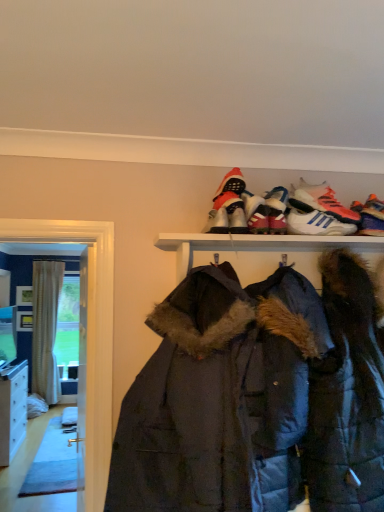
Question: Is dark blue quilted jacket at center to the right of white leather sneakers at upper center, which is the second footwear in right-to-left order, from the viewer's perspective?

Choices:
 (A) yes
 (B) no

Answer: (B)

Question: Considering the relative sizes of dark blue quilted jacket at center and white leather sneakers at upper center, which is the second footwear in right-to-left order, in the image provided, is dark blue quilted jacket at center taller than white leather sneakers at upper center, which is the second footwear in right-to-left order,?

Choices:
 (A) no
 (B) yes

Answer: (B)

Question: Is dark blue quilted jacket at center smaller than white leather sneakers at upper center, which is the 5th footwear in left-to-right order?

Choices:
 (A) no
 (B) yes

Answer: (A)

Question: Is dark blue quilted jacket at center oriented away from white leather sneakers at upper center, which is the second footwear in right-to-left order?

Choices:
 (A) yes
 (B) no

Answer: (B)

Question: Is dark blue quilted jacket at center not within white leather sneakers at upper center, which is the second footwear in right-to-left order?

Choices:
 (A) yes
 (B) no

Answer: (A)

Question: Does dark blue quilted jacket at center have a lesser height compared to white leather sneakers at upper center, which is the 5th footwear in left-to-right order?

Choices:
 (A) yes
 (B) no

Answer: (B)

Question: Can beige striped curtain at left be found inside red suede boot at upper center, the second footwear in the left-to-right sequence?

Choices:
 (A) no
 (B) yes

Answer: (A)

Question: Considering the relative positions of red suede boot at upper center, arranged as the fifth footwear when viewed from the right, and beige striped curtain at left in the image provided, is red suede boot at upper center, arranged as the fifth footwear when viewed from the right, in front of beige striped curtain at left?

Choices:
 (A) yes
 (B) no

Answer: (A)

Question: From a real-world perspective, is red suede boot at upper center, arranged as the fifth footwear when viewed from the right, physically above beige striped curtain at left?

Choices:
 (A) yes
 (B) no

Answer: (A)

Question: Considering the relative sizes of red suede boot at upper center, the second footwear in the left-to-right sequence, and beige striped curtain at left in the image provided, is red suede boot at upper center, the second footwear in the left-to-right sequence, smaller than beige striped curtain at left?

Choices:
 (A) no
 (B) yes

Answer: (B)

Question: Is red suede boot at upper center, arranged as the fifth footwear when viewed from the right, positioned with its back to beige striped curtain at left?

Choices:
 (A) no
 (B) yes

Answer: (B)

Question: Is red suede boot at upper center, arranged as the fifth footwear when viewed from the right, positioned beyond the bounds of beige striped curtain at left?

Choices:
 (A) no
 (B) yes

Answer: (B)

Question: From a real-world perspective, is white synthetic sneakers at upper center, placed as the 4th footwear when sorted from left to right, below dark blue quilted jacket at center?

Choices:
 (A) yes
 (B) no

Answer: (B)